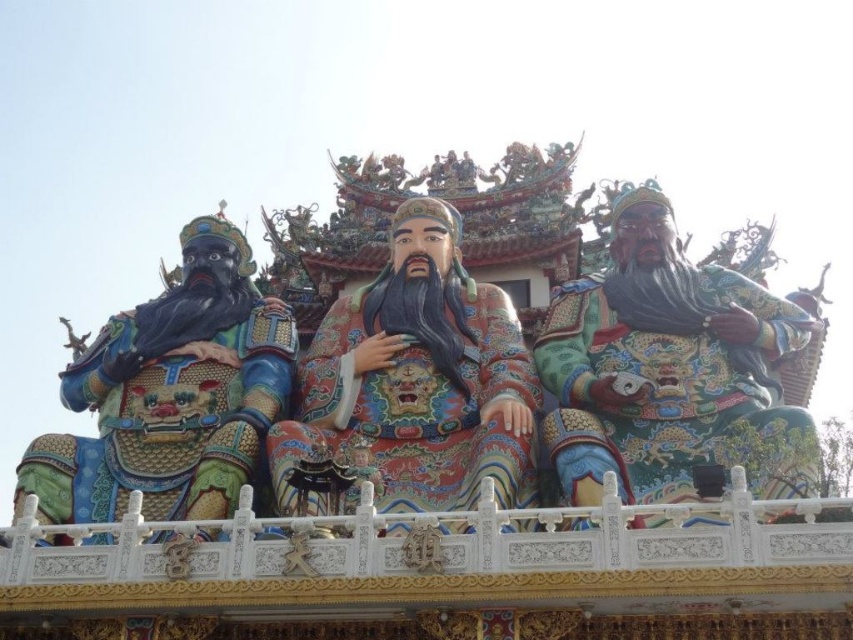
Does polychrome painted statue at center have a lesser height compared to multicolored painted statue at left?

Correct, polychrome painted statue at center is not as tall as multicolored painted statue at left.

Which is in front, point (418, 388) or point (161, 500)?

Point (161, 500) is in front.

The height and width of the screenshot is (640, 853). I want to click on polychrome painted statue at center, so click(410, 387).

Where is `polychrome painted statue at center`? This screenshot has height=640, width=853. polychrome painted statue at center is located at coordinates coord(410,387).

Identify the location of shiny green armor at right. This screenshot has width=853, height=640. 668,369.

Which of these two, shiny green armor at right or multicolored painted statue at left, stands taller?

Standing taller between the two is shiny green armor at right.

The height and width of the screenshot is (640, 853). What do you see at coordinates (668, 369) in the screenshot?
I see `shiny green armor at right` at bounding box center [668, 369].

At what (x,y) coordinates should I click in order to perform the action: click on shiny green armor at right. Please return your answer as a coordinate pair (x, y). Image resolution: width=853 pixels, height=640 pixels. Looking at the image, I should click on (668, 369).

Is shiny green armor at right above polychrome painted statue at center?

Yes, shiny green armor at right is above polychrome painted statue at center.

Is shiny green armor at right shorter than polychrome painted statue at center?

No.

Describe the element at coordinates (668, 369) in the screenshot. I see `shiny green armor at right` at that location.

Identify the location of shiny green armor at right. This screenshot has width=853, height=640. (668, 369).